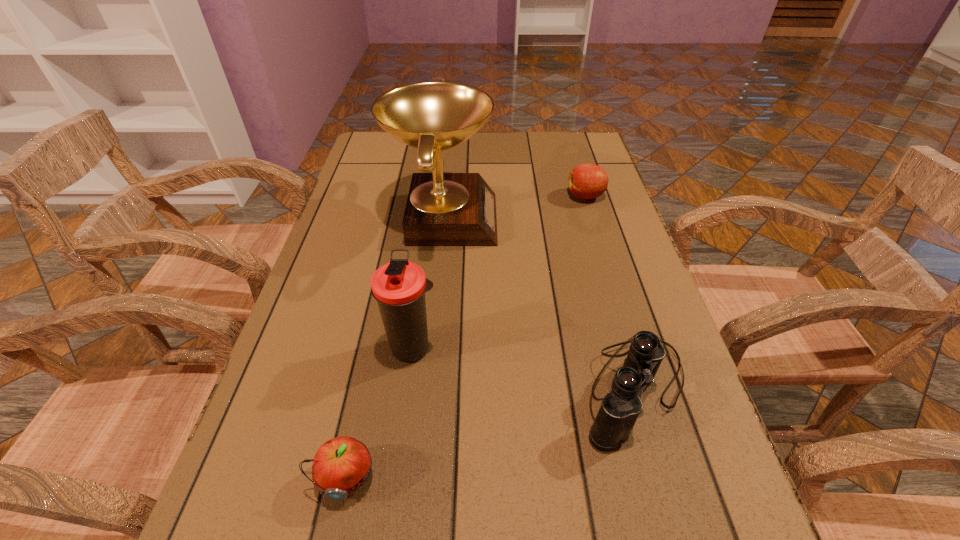
The height and width of the screenshot is (540, 960). Identify the location of free spot that satisfies the following two spatial constraints: 1. on the back side of the thermos bottle; 2. on the right side of the farther apple. (434, 196).